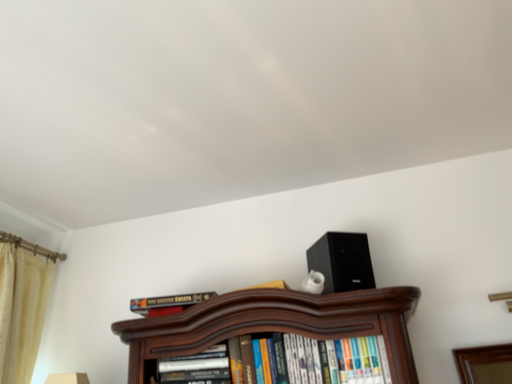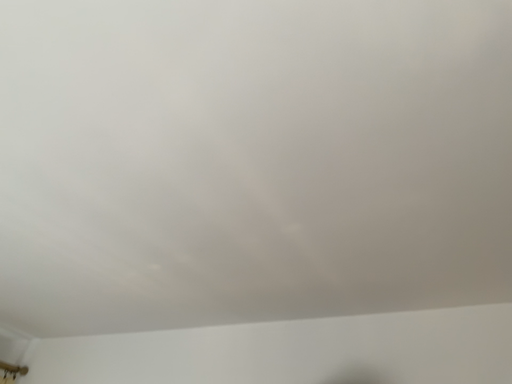
Question: How did the camera likely rotate when shooting the video?

Choices:
 (A) rotated upward
 (B) rotated downward

Answer: (A)